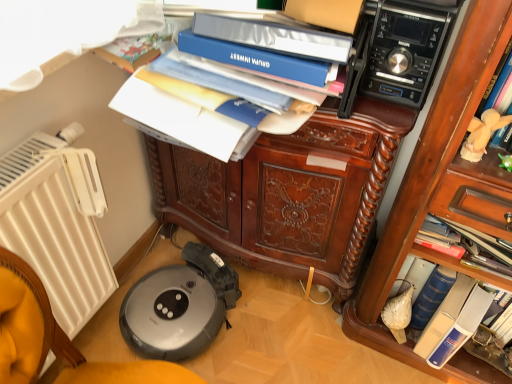
Locate an element on the screen. This screenshot has height=384, width=512. free space above blue matte folder at upper center, arranged as the 1th paperback book when viewed from the top (from a real-world perspective) is located at coordinates (260, 44).